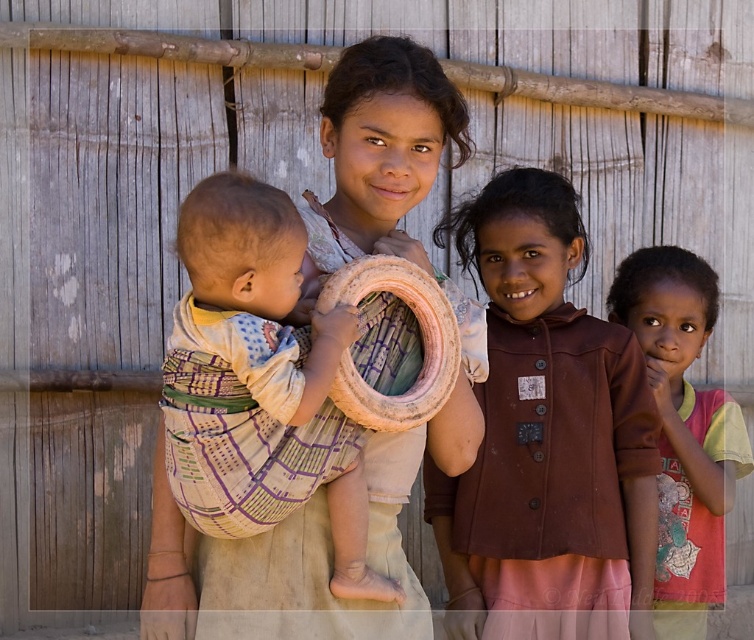
Does brown matte jacket at center have a lesser height compared to soft beige fabric baby at center?

Incorrect, brown matte jacket at center's height does not fall short of soft beige fabric baby at center's.

Which of these two, brown matte jacket at center or soft beige fabric baby at center, stands taller?

brown matte jacket at center is taller.

Is point (489, 480) more distant than point (231, 205)?

Yes, it is behind point (231, 205).

Where is `brown matte jacket at center`? This screenshot has width=754, height=640. brown matte jacket at center is located at coordinates (546, 440).

Is brown matte jacket at center smaller than pink fabric shirt at right?

No.

From the picture: Between brown matte jacket at center and pink fabric shirt at right, which one has more height?

Standing taller between the two is brown matte jacket at center.

This screenshot has height=640, width=754. What do you see at coordinates (546, 440) in the screenshot?
I see `brown matte jacket at center` at bounding box center [546, 440].

Locate an element on the screen. This screenshot has width=754, height=640. brown matte jacket at center is located at coordinates (546, 440).

Does point (259, 506) lie behind point (700, 401)?

No, it is not.

Does point (185, 237) lie in front of point (722, 547)?

Yes, it is in front of point (722, 547).

You are a GUI agent. You are given a task and a screenshot of the screen. Output one action in this format:
    pyautogui.click(x=<x>, y=<y>)
    Task: Click on the soft beige fabric baby at center
    The height and width of the screenshot is (640, 754).
    Given the screenshot: What is the action you would take?
    pyautogui.click(x=259, y=381)

The image size is (754, 640). I want to click on soft beige fabric baby at center, so click(259, 381).